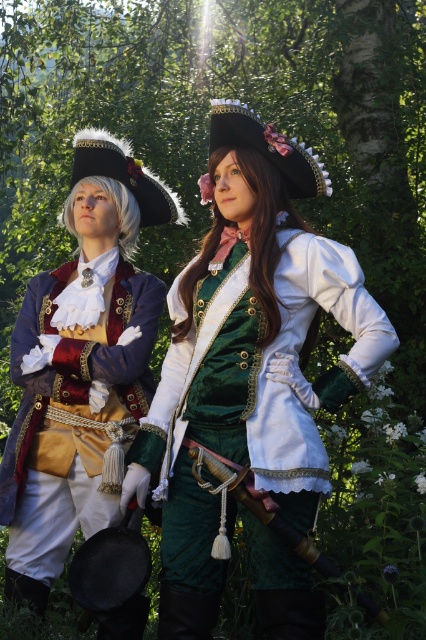
Question: Can you confirm if green velvet jacket at center is thinner than green velvet coat at center?

Choices:
 (A) yes
 (B) no

Answer: (B)

Question: Is the position of green velvet jacket at center more distant than that of green velvet coat at center?

Choices:
 (A) yes
 (B) no

Answer: (B)

Question: Which point is farther from the camera taking this photo?

Choices:
 (A) (222, 241)
 (B) (46, 273)

Answer: (B)

Question: Which object is farther from the camera taking this photo?

Choices:
 (A) green velvet jacket at center
 (B) green velvet coat at center

Answer: (B)

Question: Which point is farther to the camera?

Choices:
 (A) green velvet jacket at center
 (B) green velvet coat at center

Answer: (B)

Question: Is green velvet jacket at center above green velvet coat at center?

Choices:
 (A) no
 (B) yes

Answer: (B)